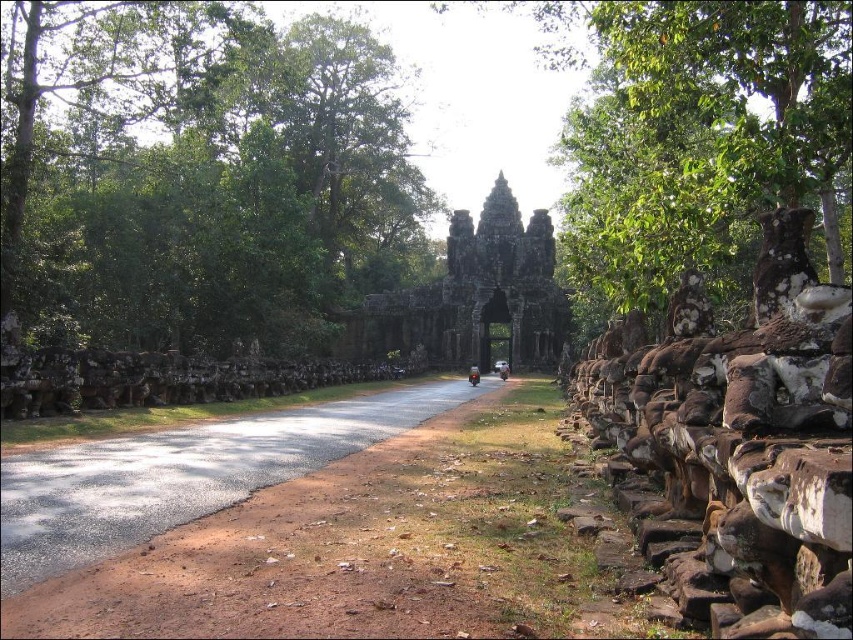
Question: Among these points, which one is nearest to the camera?

Choices:
 (A) (436, 324)
 (B) (160, 436)
 (C) (242, 136)
 (D) (476, 378)

Answer: (B)

Question: Does green leafy trees at upper left appear on the right side of asphalt road at center?

Choices:
 (A) yes
 (B) no

Answer: (B)

Question: Is green leafy trees at upper left to the left of dark stone gate at center from the viewer's perspective?

Choices:
 (A) yes
 (B) no

Answer: (A)

Question: Considering the relative positions of green leafy trees at upper left and asphalt road at center in the image provided, where is green leafy trees at upper left located with respect to asphalt road at center?

Choices:
 (A) right
 (B) left

Answer: (B)

Question: Among these points, which one is farthest from the camera?

Choices:
 (A) (387, 625)
 (B) (440, 205)

Answer: (B)

Question: Which point is farther to the camera?

Choices:
 (A) dark stone gate at center
 (B) shiny red motorcycle at center
 (C) green leafy trees at upper left
 (D) asphalt road at center

Answer: (A)